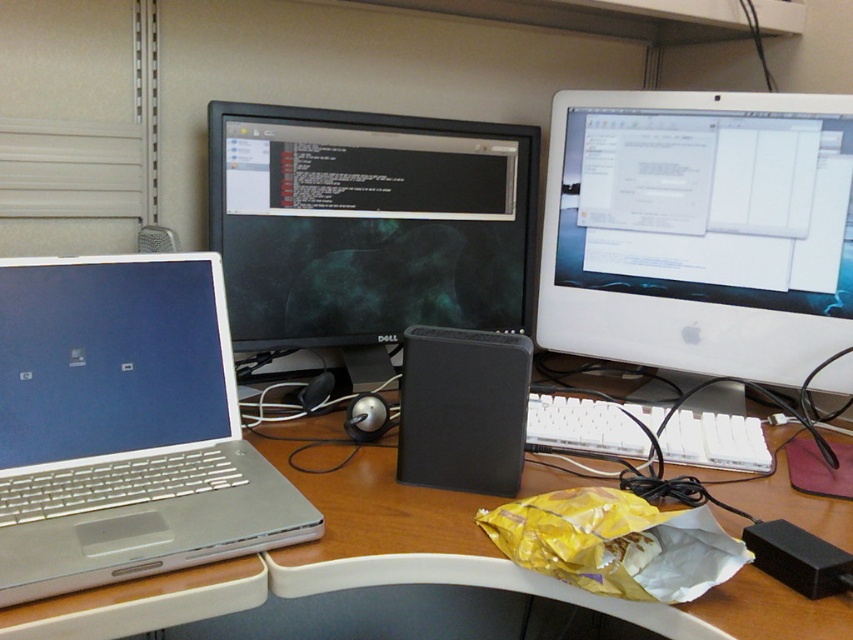
You are organizing your desk and want to place a new mouse between the black glossy monitor at center and the white plastic keyboard at center. Which side of the monitor should you place it so it doesn

The black glossy monitor at center is taller than the white plastic keyboard at center, so placing the mouse to the side of the monitor would ensure it is within reach while maintaining a neat setup.

You are organizing cables on a desk and need to connect a new USB device. The silver metallic laptop at left requires a specific cable that is only available near the black plastic speaker at center. Can you reach the cable without moving either device?

The silver metallic laptop at left is closer to the viewer than the black plastic speaker at center, so you can reach the cable from the black plastic speaker at center to the silver metallic laptop at left without needing to move either device.